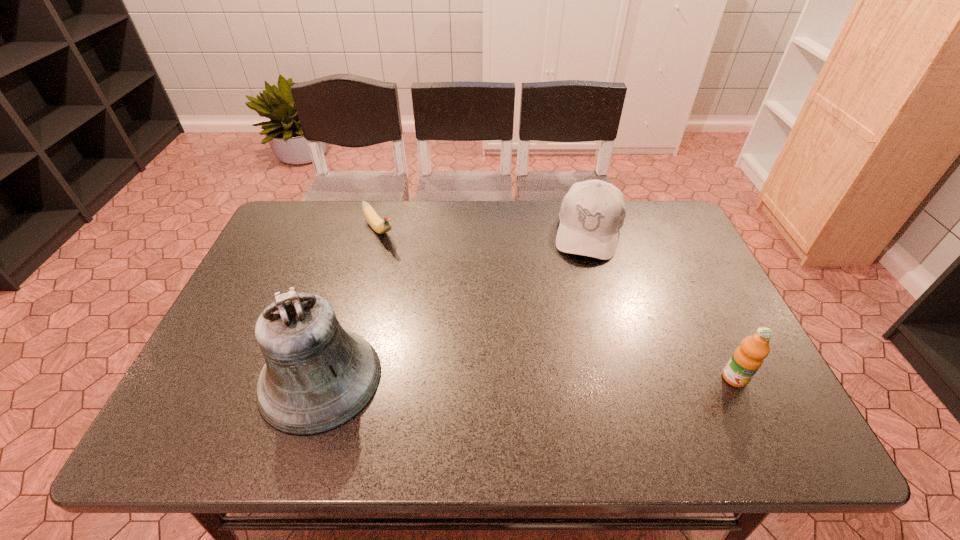
I want to click on vacant area that lies between the orange juice and the third object from left to right, so click(661, 305).

At what (x,y) coordinates should I click in order to perform the action: click on free area in between the bell and the shortest object. Please return your answer as a coordinate pair (x, y). This screenshot has width=960, height=540. Looking at the image, I should click on (349, 305).

The width and height of the screenshot is (960, 540). I want to click on free point between the rightmost object and the bell, so click(527, 379).

At what (x,y) coordinates should I click in order to perform the action: click on blank region between the second object from right to left and the shortest object. Please return your answer as a coordinate pair (x, y). Looking at the image, I should click on (484, 231).

I want to click on free space between the rightmost object and the tallest object, so click(x=527, y=379).

Where is `the second closest object to the baseball cap`? This screenshot has width=960, height=540. the second closest object to the baseball cap is located at coordinates (380, 226).

Find the location of a particular element. This screenshot has width=960, height=540. object that is the second closest to the bell is located at coordinates (592, 213).